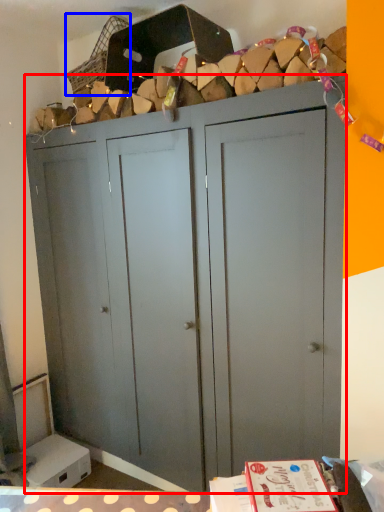
Question: Which object appears farthest to the camera in this image, cupboard (highlighted by a red box) or basket (highlighted by a blue box)?

Choices:
 (A) cupboard
 (B) basket

Answer: (B)